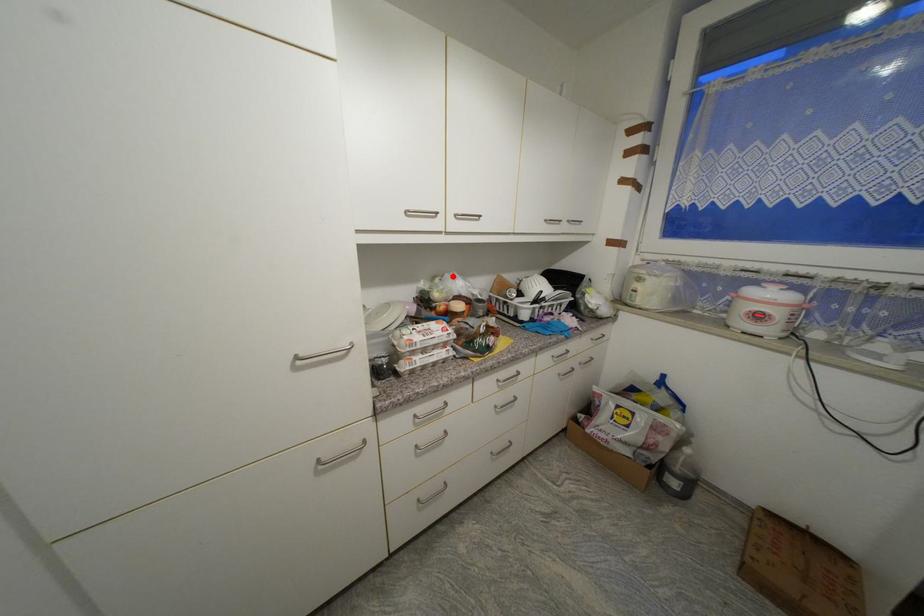
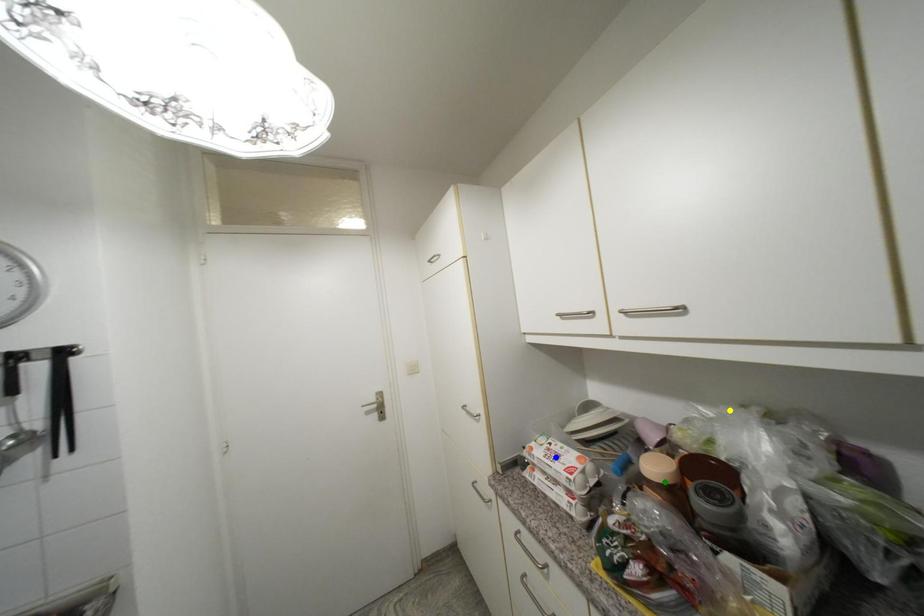
Question: I am providing you with two images of the same scene from different viewpoints. A red point is marked on the first image. You are given multiple points on the second image. Which point in image 2 represents the same 3d spot as the red point in image 1?

Choices:
 (A) yellow point
 (B) green point
 (C) blue point

Answer: (A)